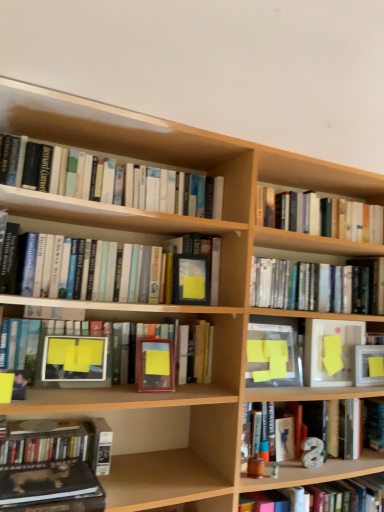
Question: Which direction should I rotate to look at wooden picture frame at center, arranged as the second picture frame when viewed from the left, — up or down?

Choices:
 (A) down
 (B) up

Answer: (A)

Question: Does hardcover book at lower left, the fifth book viewed from the top, come in front of yellow matte paper at center, the second paperback book when ordered from left to right?

Choices:
 (A) no
 (B) yes

Answer: (B)

Question: Is hardcover book at lower left, marked as the third book in a bottom-to-top arrangement, facing away from yellow matte paper at center, the second paperback book when ordered from left to right?

Choices:
 (A) yes
 (B) no

Answer: (B)

Question: Is hardcover book at lower left, marked as the third book in a bottom-to-top arrangement, to the right of yellow matte paper at center, the second paperback book when ordered from left to right, from the viewer's perspective?

Choices:
 (A) yes
 (B) no

Answer: (B)

Question: From a real-world perspective, is hardcover book at lower left, the fifth book viewed from the top, over yellow matte paper at center, the second paperback book when ordered from left to right?

Choices:
 (A) yes
 (B) no

Answer: (B)

Question: From a real-world perspective, is hardcover book at lower left, marked as the third book in a bottom-to-top arrangement, located beneath yellow matte paper at center, the second paperback book when ordered from left to right?

Choices:
 (A) yes
 (B) no

Answer: (A)

Question: From the image's perspective, is hardcover book at lower left, marked as the third book in a bottom-to-top arrangement, under yellow matte paper at center, positioned as the 2th paperback book in right-to-left order?

Choices:
 (A) yes
 (B) no

Answer: (A)

Question: Would you say hardcover book at center, which is the fourth book in bottom-to-top order, contains hardcover book at center, which is the 6th book in bottom-to-top order?

Choices:
 (A) no
 (B) yes

Answer: (A)

Question: Considering the relative sizes of hardcover book at center, which is the fourth book in bottom-to-top order, and hardcover book at center, which is the 6th book in bottom-to-top order, in the image provided, is hardcover book at center, which is the fourth book in bottom-to-top order, wider than hardcover book at center, which is the 6th book in bottom-to-top order,?

Choices:
 (A) yes
 (B) no

Answer: (B)

Question: Can you confirm if hardcover book at center, which is the fourth book in bottom-to-top order, is bigger than hardcover book at center, which is the 6th book in bottom-to-top order?

Choices:
 (A) yes
 (B) no

Answer: (B)

Question: Considering the relative positions of hardcover book at center, which appears as the fourth book when viewed from the top, and hardcover book at center, which is the 6th book in bottom-to-top order, in the image provided, is hardcover book at center, which appears as the fourth book when viewed from the top, in front of hardcover book at center, which is the 6th book in bottom-to-top order,?

Choices:
 (A) no
 (B) yes

Answer: (B)

Question: From a real-world perspective, does hardcover book at center, which is the fourth book in bottom-to-top order, stand above hardcover book at center, which is the 6th book in bottom-to-top order?

Choices:
 (A) yes
 (B) no

Answer: (B)

Question: Is hardcover book at center, which appears as the fourth book when viewed from the top, not close to hardcover book at center, which appears as the 2th book when viewed from the top?

Choices:
 (A) yes
 (B) no

Answer: (B)

Question: From the image's perspective, is hardcover book at center, which is the 6th book in bottom-to-top order, on top of matte black book at center, which ranks as the 1th paperback book in left-to-right order?

Choices:
 (A) yes
 (B) no

Answer: (A)